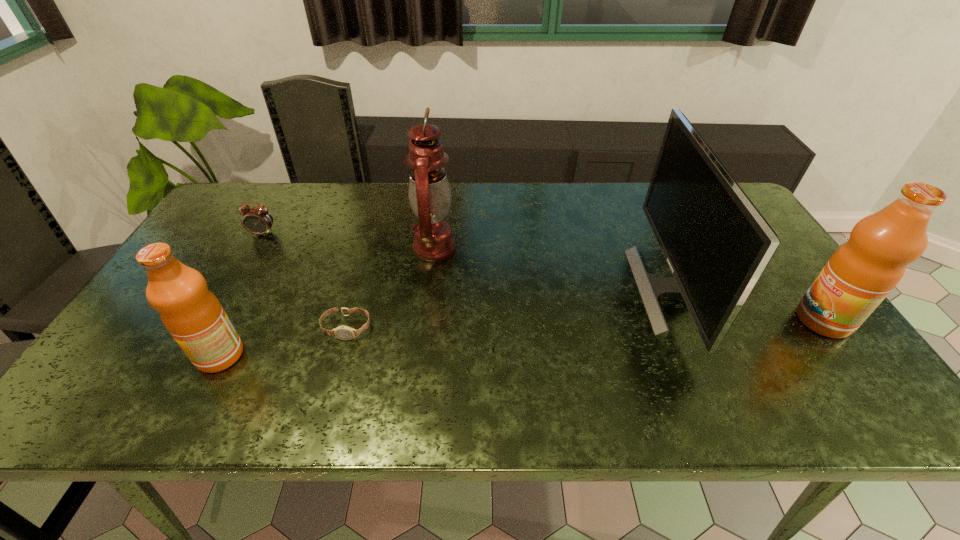
This screenshot has width=960, height=540. I want to click on free spot between the third shortest object and the shortest object, so click(x=283, y=342).

At what (x,y) coordinates should I click in order to perform the action: click on vacant area that lies between the third object from left to right and the monitor. Please return your answer as a coordinate pair (x, y). The width and height of the screenshot is (960, 540). Looking at the image, I should click on (509, 309).

This screenshot has width=960, height=540. What are the coordinates of `free spot between the second shortest object and the watch` in the screenshot? It's located at (304, 281).

At what (x,y) coordinates should I click in order to perform the action: click on vacant point located between the alarm clock and the right fruit juice. Please return your answer as a coordinate pair (x, y). The image size is (960, 540). Looking at the image, I should click on (x=543, y=277).

This screenshot has width=960, height=540. Identify the location of free space between the oil lamp and the right fruit juice. (629, 284).

Locate an element on the screen. The width and height of the screenshot is (960, 540). vacant region between the second object from right to left and the oil lamp is located at coordinates (552, 268).

The height and width of the screenshot is (540, 960). In order to click on free space between the fifth tallest object and the rightmost object in this screenshot , I will do `click(543, 277)`.

What are the coordinates of `vacant space that's between the alarm clock and the taller fruit juice` in the screenshot? It's located at (543, 277).

Locate which object is the third closest to the monitor. Please provide its 2D coordinates. Your answer should be formatted as a tuple, i.e. [(x, y)], where the tuple contains the x and y coordinates of a point satisfying the conditions above.

[(342, 332)]

You are a GUI agent. You are given a task and a screenshot of the screen. Output one action in this format:
    pyautogui.click(x=<x>, y=<y>)
    Task: Click on the object that ranks as the fourth closest to the right fruit juice
    
    Given the screenshot: What is the action you would take?
    pyautogui.click(x=192, y=314)